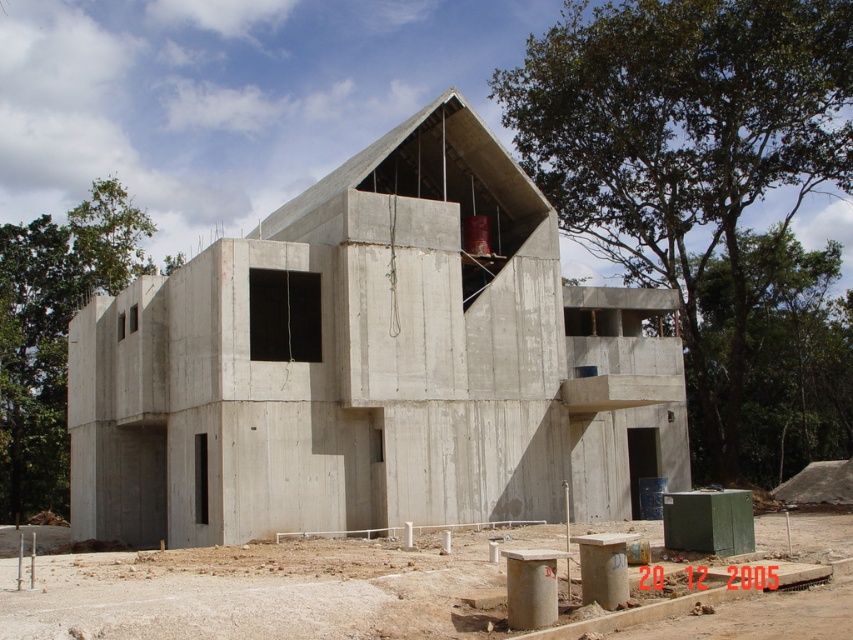
You are an architect designing a new structure. You have to place a temporary support structure for the concrete at center. Since the concrete building at center is in the way, where should you place the support relative to it?

The concrete at center is behind the concrete building at center, so you should place the support behind the concrete building at center to access the concrete at center.